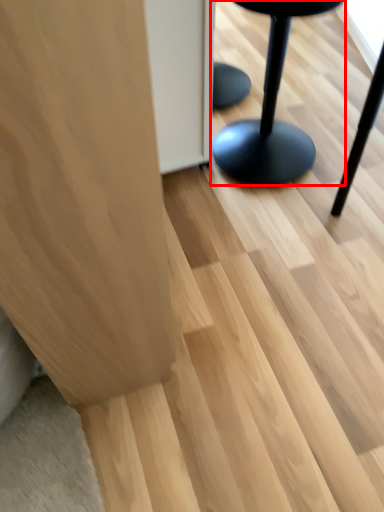
Question: In this image, where is furniture (annotated by the red box) located relative to furniture?

Choices:
 (A) left
 (B) right

Answer: (B)